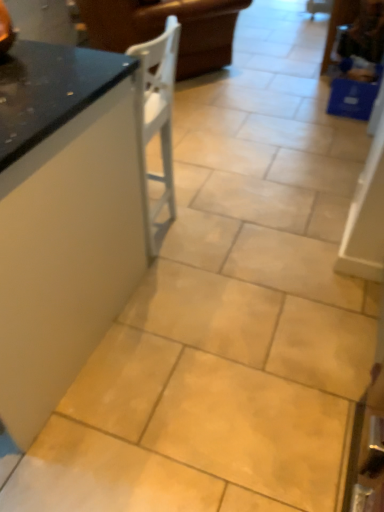
Question: Is white wood chair at upper left wider or thinner than black glossy countertop at left?

Choices:
 (A) wide
 (B) thin

Answer: (A)

Question: Would you say white wood chair at upper left is to the left or to the right of black glossy countertop at left in the picture?

Choices:
 (A) right
 (B) left

Answer: (A)

Question: From a real-world perspective, is white wood chair at upper left physically located above or below black glossy countertop at left?

Choices:
 (A) above
 (B) below

Answer: (B)

Question: Relative to white wood chair at upper left, is black glossy countertop at left in front or behind?

Choices:
 (A) front
 (B) behind

Answer: (A)

Question: Looking at their shapes, would you say black glossy countertop at left is wider or thinner than white wood chair at upper left?

Choices:
 (A) wide
 (B) thin

Answer: (B)

Question: From a real-world perspective, is black glossy countertop at left physically located above or below white wood chair at upper left?

Choices:
 (A) below
 (B) above

Answer: (B)

Question: Which is correct: black glossy countertop at left is inside white wood chair at upper left, or outside of it?

Choices:
 (A) inside
 (B) outside

Answer: (B)